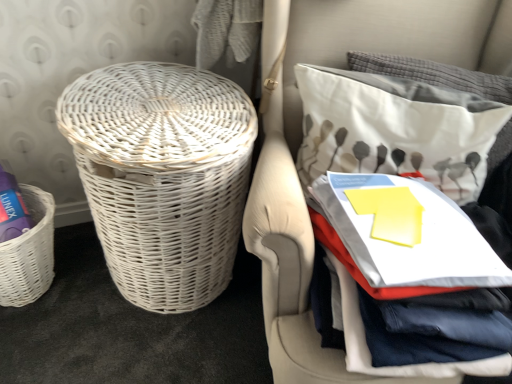
Measure the distance between white wicker basket at left and camera.

The depth of white wicker basket at left is 26.56 inches.

The image size is (512, 384). Describe the element at coordinates (29, 253) in the screenshot. I see `white wicker basket at left, placed as the second basket when sorted from right to left` at that location.

Describe the element at coordinates (395, 129) in the screenshot. This screenshot has width=512, height=384. I see `white fabric pillow at upper right` at that location.

You are a GUI agent. You are given a task and a screenshot of the screen. Output one action in this format:
    pyautogui.click(x=<x>, y=<y>)
    Task: Click on the white wicker basket at left, the 2th basket positioned from the left
    The width and height of the screenshot is (512, 384).
    Given the screenshot: What is the action you would take?
    pyautogui.click(x=162, y=176)

Can you see white wicker basket at left touching white wicker basket at left, which is the 1th basket from left to right?

No, white wicker basket at left is not touching white wicker basket at left, which is the 1th basket from left to right.

From a real-world perspective, is white wicker basket at left below white wicker basket at left, which is the 1th basket from left to right?

Actually, white wicker basket at left is physically above white wicker basket at left, which is the 1th basket from left to right, in the real world.

From the image's perspective, is white wicker basket at left under white wicker basket at left, which is the 1th basket from left to right?

Incorrect, from the image's perspective, white wicker basket at left is higher than white wicker basket at left, which is the 1th basket from left to right.

Identify the location of basket that is the 2nd object located below the white wicker basket at left (from the image's perspective). (29, 253).

Is white wicker basket at left, which is the 1th basket from left to right, inside the boundaries of white fabric pillow at upper right, or outside?

white wicker basket at left, which is the 1th basket from left to right, lies outside white fabric pillow at upper right.

Which point is more forward, (40,294) or (330,152)?

Point (330,152)

Is there a large distance between white wicker basket at left, placed as the second basket when sorted from right to left, and white fabric pillow at upper right?

No, white wicker basket at left, placed as the second basket when sorted from right to left, is not far from white fabric pillow at upper right.

Is white wicker basket at left, which is the 1th basket from left to right, wider than white fabric pillow at upper right?

Correct, the width of white wicker basket at left, which is the 1th basket from left to right, exceeds that of white fabric pillow at upper right.

Can you confirm if white wicker basket at left, the first basket from the right, is shorter than white wicker basket at left?

Indeed, white wicker basket at left, the first basket from the right, has a lesser height compared to white wicker basket at left.

From a real-world perspective, which is physically above, white wicker basket at left, the 2th basket positioned from the left, or white wicker basket at left?

white wicker basket at left, from a real-world perspective.

Considering the points (253, 125) and (341, 34), which point is in front, point (253, 125) or point (341, 34)?

The point (253, 125) is closer to the camera.

The image size is (512, 384). Find the location of `pillow on the left of white wicker basket at left`. pillow on the left of white wicker basket at left is located at coordinates (395, 129).

Is white fabric pillow at upper right surrounding white wicker basket at left?

Actually, white wicker basket at left is outside white fabric pillow at upper right.

Can you tell me how much white fabric pillow at upper right and white wicker basket at left differ in facing direction?

There is a 20.6-degree angle between the facing directions of white fabric pillow at upper right and white wicker basket at left.

Is the position of white fabric pillow at upper right less distant than that of white wicker basket at left?

No, white fabric pillow at upper right is further to the viewer.

Could you measure the distance between white wicker basket at left, which is the 1th basket from left to right, and white wicker basket at left, the 2th basket positioned from the left?

The distance of white wicker basket at left, which is the 1th basket from left to right, from white wicker basket at left, the 2th basket positioned from the left, is 14.03 inches.

From the image's perspective, is white wicker basket at left, placed as the second basket when sorted from right to left, above or below white wicker basket at left, the first basket from the right?

Based on their image positions, white wicker basket at left, placed as the second basket when sorted from right to left, is located beneath white wicker basket at left, the first basket from the right.

Does white wicker basket at left, placed as the second basket when sorted from right to left, lie in front of white wicker basket at left, the first basket from the right?

No, white wicker basket at left, placed as the second basket when sorted from right to left, is further to the viewer.

Could white wicker basket at left, the 2th basket positioned from the left, be considered to be inside white wicker basket at left, which is the 1th basket from left to right?

No, white wicker basket at left, the 2th basket positioned from the left, is located outside of white wicker basket at left, which is the 1th basket from left to right.

You are a GUI agent. You are given a task and a screenshot of the screen. Output one action in this format:
    pyautogui.click(x=<x>, y=<y>)
    Task: Click on the 1st basket below the white fabric pillow at upper right (from the image's perspective)
    This screenshot has height=384, width=512.
    Given the screenshot: What is the action you would take?
    pyautogui.click(x=162, y=176)

Does white wicker basket at left, the first basket from the right, appear on the left side of white fabric pillow at upper right?

Yes.

Is white wicker basket at left, the first basket from the right, taller than white fabric pillow at upper right?

Yes.

Is the depth of white wicker basket at left, the 2th basket positioned from the left, greater than that of white fabric pillow at upper right?

No, white wicker basket at left, the 2th basket positioned from the left, is in front of white fabric pillow at upper right.

From the image's perspective, which is below, white wicker basket at left, which is the 1th basket from left to right, or white wicker basket at left?

white wicker basket at left, which is the 1th basket from left to right.

Which object is positioned more to the left, white wicker basket at left, placed as the second basket when sorted from right to left, or white wicker basket at left?

white wicker basket at left, placed as the second basket when sorted from right to left, is more to the left.

Looking at their sizes, would you say white wicker basket at left, placed as the second basket when sorted from right to left, is wider or thinner than white wicker basket at left?

Considering their sizes, white wicker basket at left, placed as the second basket when sorted from right to left, looks slimmer than white wicker basket at left.

Can you tell me how much white wicker basket at left, placed as the second basket when sorted from right to left, and white wicker basket at left differ in facing direction?

They differ by 18.4 degrees in their facing directions.

Find the location of a particular element. This screenshot has height=384, width=512. the 2nd basket counting from the left of the white wicker basket at left is located at coordinates (29, 253).

Locate an element on the screen. basket behind the white fabric pillow at upper right is located at coordinates (29, 253).

In the scene shown: Which object lies further to the anchor point white fabric pillow at upper right, white wicker basket at left or white wicker basket at left, the first basket from the right?

white wicker basket at left, the first basket from the right, lies further to white fabric pillow at upper right than the other object.

From the picture: When comparing their distances from white wicker basket at left, the first basket from the right, does white wicker basket at left or white wicker basket at left, which is the 1th basket from left to right, seem further?

The object further to white wicker basket at left, the first basket from the right, is white wicker basket at left, which is the 1th basket from left to right.

Looking at the image, which one is located closer to white fabric pillow at upper right, white wicker basket at left, the 2th basket positioned from the left, or white wicker basket at left?

Based on the image, white wicker basket at left appears to be nearer to white fabric pillow at upper right.

Which object lies nearer to the anchor point white wicker basket at left, white wicker basket at left, the first basket from the right, or white wicker basket at left, placed as the second basket when sorted from right to left?

Among the two, white wicker basket at left, the first basket from the right, is located nearer to white wicker basket at left.

From the image, which object appears to be nearer to white wicker basket at left, the first basket from the right, white wicker basket at left, placed as the second basket when sorted from right to left, or white wicker basket at left?

white wicker basket at left lies closer to white wicker basket at left, the first basket from the right, than the other object.

Considering their positions, is white fabric pillow at upper right positioned further to white wicker basket at left than white wicker basket at left, the first basket from the right?

Among the two, white wicker basket at left, the first basket from the right, is located further to white wicker basket at left.

Looking at the image, which one is located further to white fabric pillow at upper right, white wicker basket at left or white wicker basket at left, which is the 1th basket from left to right?

Among the two, white wicker basket at left, which is the 1th basket from left to right, is located further to white fabric pillow at upper right.

Considering their positions, is white fabric pillow at upper right positioned further to white wicker basket at left, placed as the second basket when sorted from right to left, than white wicker basket at left, the first basket from the right?

white fabric pillow at upper right is positioned further to the anchor white wicker basket at left, placed as the second basket when sorted from right to left.

Where is `basket between white wicker basket at left, which is the 1th basket from left to right, and white wicker basket at left from left to right`? This screenshot has height=384, width=512. basket between white wicker basket at left, which is the 1th basket from left to right, and white wicker basket at left from left to right is located at coordinates (162, 176).

The image size is (512, 384). Find the location of `pillow located between white wicker basket at left, which is the 1th basket from left to right, and white wicker basket at left in the left-right direction`. pillow located between white wicker basket at left, which is the 1th basket from left to right, and white wicker basket at left in the left-right direction is located at coordinates (395, 129).

This screenshot has width=512, height=384. In order to click on basket between white wicker basket at left, placed as the second basket when sorted from right to left, and white fabric pillow at upper right in this screenshot , I will do `click(162, 176)`.

Find the location of `pillow between white wicker basket at left, the 2th basket positioned from the left, and white wicker basket at left`. pillow between white wicker basket at left, the 2th basket positioned from the left, and white wicker basket at left is located at coordinates pyautogui.click(x=395, y=129).